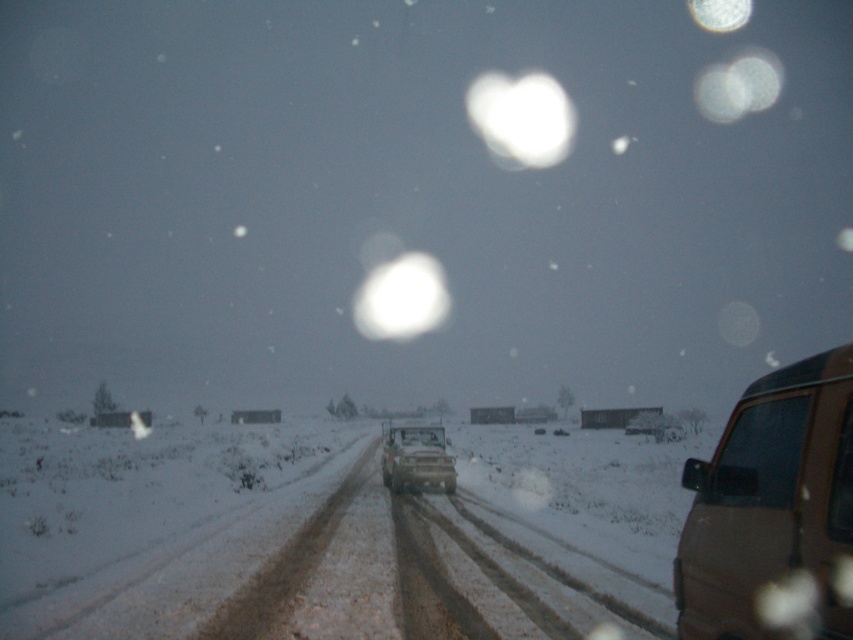
You are driving a car and want to know if the snowy dirt road at center is higher than the metallic silver truck at center. Can you confirm this based on the scene?

The snowy dirt road at center is taller than metallic silver truck at center, so yes, the snowy dirt road at center is higher than the metallic silver truck at center.

You are driving a car and see the point at coordinates (326, 536) on the snowy dirt road at center. Is this point on the road or off the road?

The point at coordinates (326, 536) is on the snowy dirt road at center, so it is on the road.

You are driving a car and want to overtake the brown matte van at right. Based on the snowy dirt road at center, can you safely pass the van on the road?

The snowy dirt road at center is below the brown matte van at right, which means the road is positioned lower than the van. This suggests the road slopes downward in that area, potentially making it unsafe to overtake due to reduced visibility of oncoming traffic or potential hazards ahead. It is advisable to avoid overtaking here.